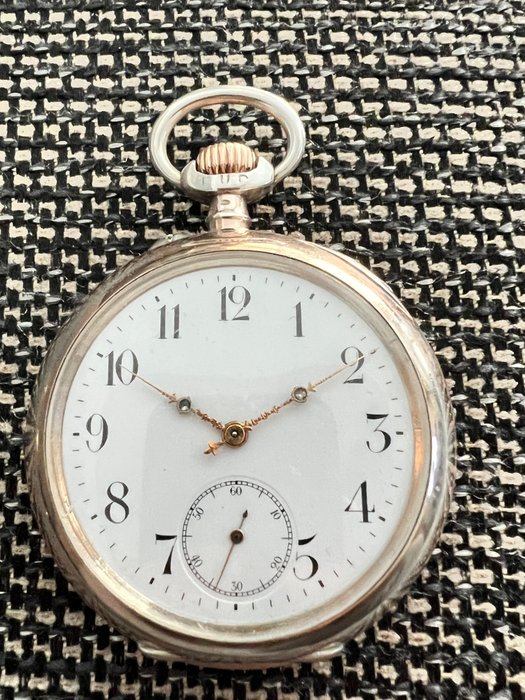
The image size is (525, 700). I want to click on clock face, so click(x=302, y=453).